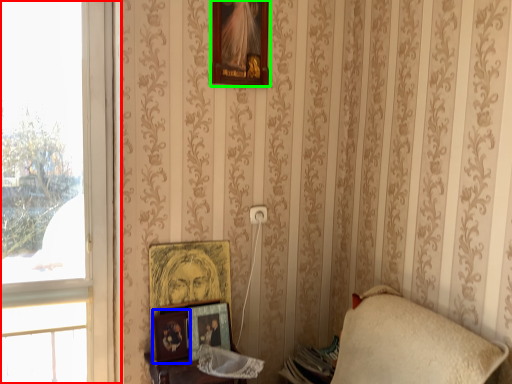
Question: Estimate the real-world distances between objects in this image. Which object is farther from window (highlighted by a red box), picture frame (highlighted by a blue box) or picture frame (highlighted by a green box)?

Choices:
 (A) picture frame
 (B) picture frame

Answer: (B)